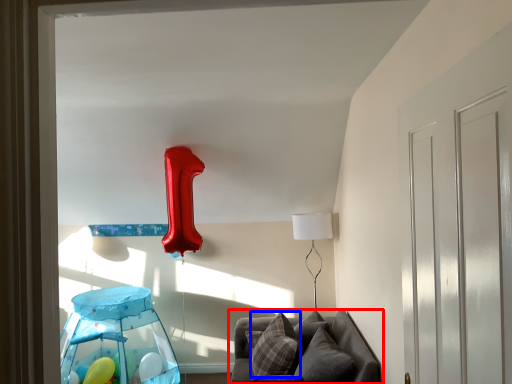
Question: Which point is further to the camera, furniture (highlighted by a red box) or pillow (highlighted by a blue box)?

Choices:
 (A) furniture
 (B) pillow

Answer: (B)